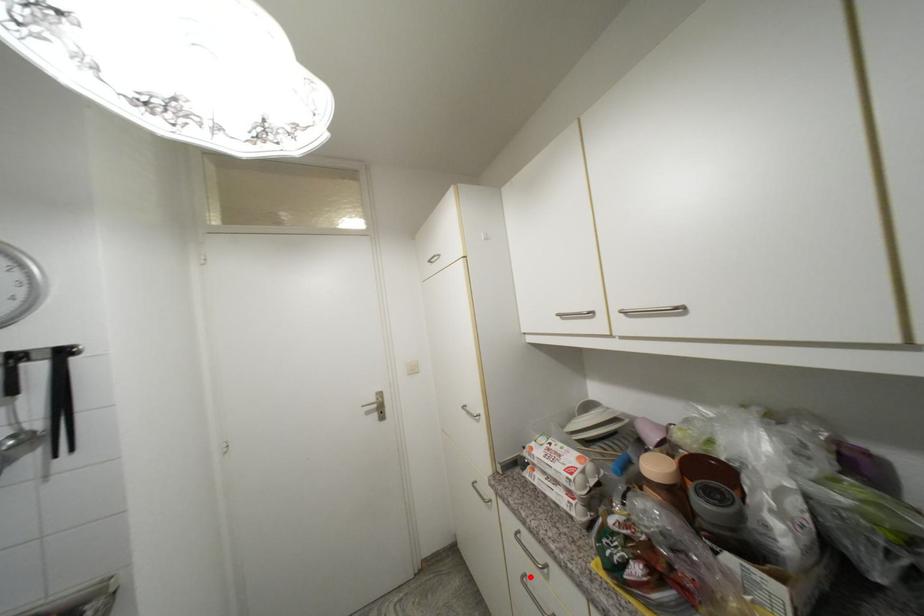
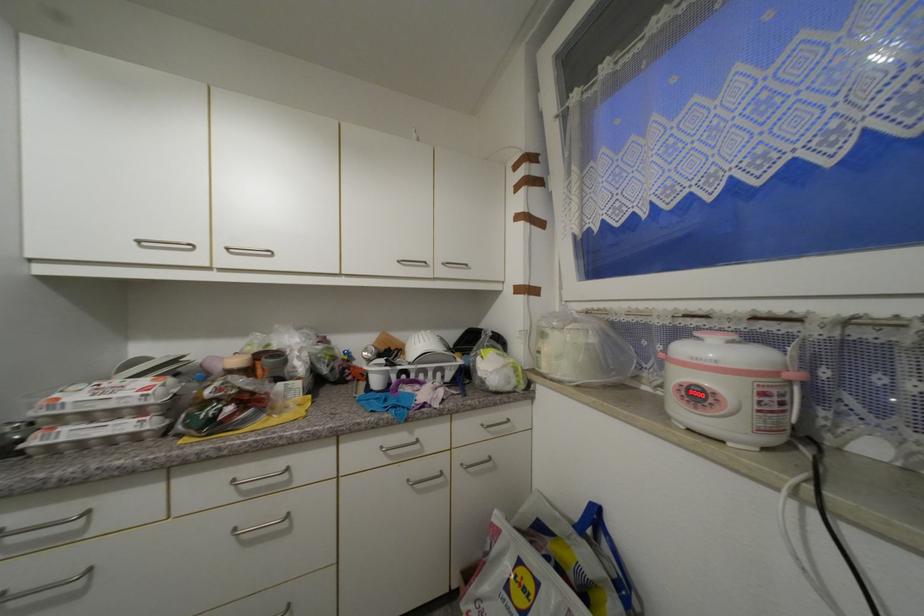
Question: A red point is marked in image1. In image2, is the corresponding 3D point closer to the camera or farther? Reply with the corresponding letter.

Choices:
 (A) The corresponding 3D point is closer.
 (B) The corresponding 3D point is farther.

Answer: (A)